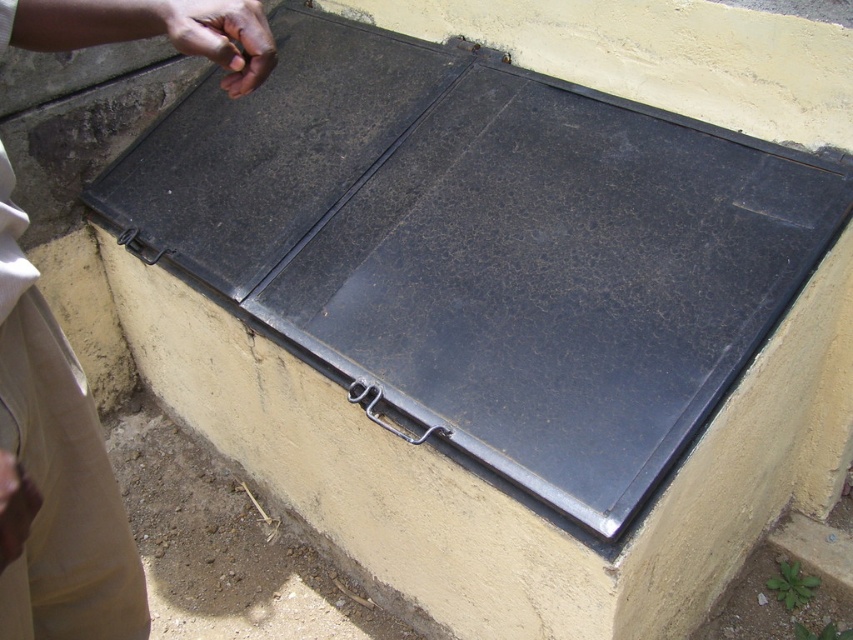
You are standing at the point marked by the coordinate point (54, 474) in the image. What object is located at that point?

The point (54, 474) corresponds to the beige fabric pants at lower left.

You are a person standing in the scene and you see the beige fabric pants at lower left and the dark skin hand at upper left. Which object is closer to the ground?

The beige fabric pants at lower left is below the dark skin hand at upper left, so it is closer to the ground.

You are a person trying to reach a button located at the position of the dark skin hand at upper left while standing near the beige fabric pants at lower left. Can you comfortably reach the button without moving your feet?

The distance between the beige fabric pants at lower left and the dark skin hand at upper left is 9.38 inches. Since this distance is relatively short, you can comfortably reach the button without moving your feet.